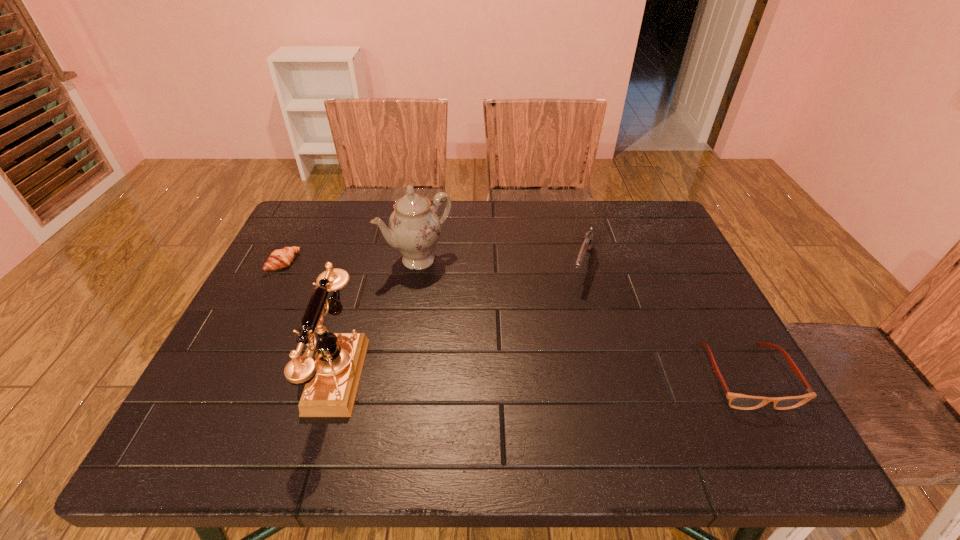
The image size is (960, 540). I want to click on vacant space at the far left corner of the desktop, so click(x=338, y=204).

Locate an element on the screen. vacant space at the near left corner of the desktop is located at coordinates (212, 399).

Where is `vacant space at the far right corner of the desktop`? The height and width of the screenshot is (540, 960). vacant space at the far right corner of the desktop is located at coordinates (650, 224).

This screenshot has width=960, height=540. In order to click on free spot at the near right corner of the desktop in this screenshot , I will do `click(718, 394)`.

You are a GUI agent. You are given a task and a screenshot of the screen. Output one action in this format:
    pyautogui.click(x=<x>, y=<y>)
    Task: Click on the free spot between the second object from right to left and the telephone
    The image size is (960, 540).
    Given the screenshot: What is the action you would take?
    pyautogui.click(x=457, y=320)

Image resolution: width=960 pixels, height=540 pixels. I want to click on free space between the rightmost object and the leftmost object, so click(515, 320).

Locate an element on the screen. The width and height of the screenshot is (960, 540). free space between the third shortest object and the chinaware is located at coordinates (500, 262).

The width and height of the screenshot is (960, 540). In order to click on empty location between the shortest object and the rightmost object in this screenshot , I will do `click(515, 320)`.

At what (x,y) coordinates should I click in order to perform the action: click on free point between the chinaware and the spectacles. Please return your answer as a coordinate pair (x, y). This screenshot has width=960, height=540. Looking at the image, I should click on (582, 318).

Locate an element on the screen. This screenshot has height=540, width=960. vacant area that lies between the fourth object from left to right and the pastry is located at coordinates coord(433,265).